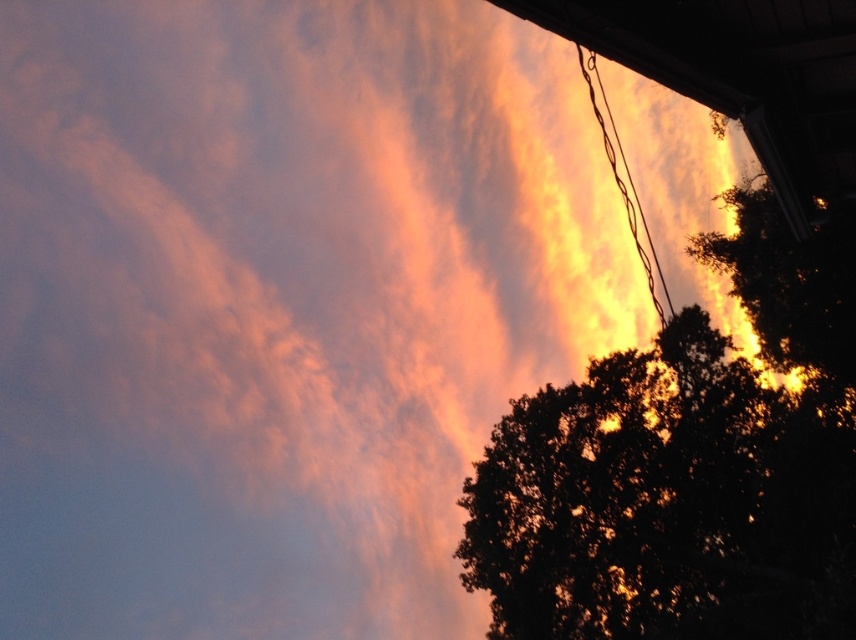
Between silhouette leafy tree at upper right and yellow-orange wire at upper right, which one is positioned lower?

silhouette leafy tree at upper right is below.

Does point (823, 371) lie in front of point (658, 308)?

Yes, it is in front of point (658, 308).

I want to click on silhouette leafy tree at upper right, so click(x=688, y=467).

Where is `silhouette leafy tree at upper right`? This screenshot has width=856, height=640. silhouette leafy tree at upper right is located at coordinates (688, 467).